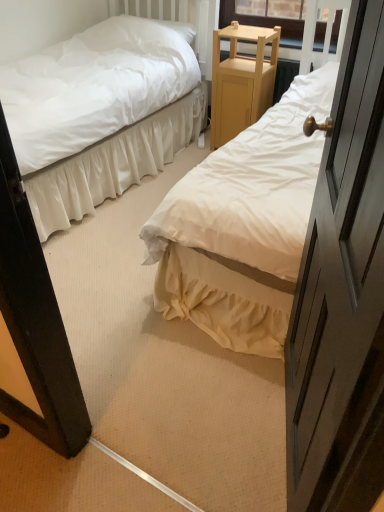
Measure the distance between point (222, 174) and camera.

5.95 feet.

Image resolution: width=384 pixels, height=512 pixels. I want to click on white soft pillow at upper left, so click(x=180, y=29).

What is the approximate width of white satin bed at center, which is the 1th bed in left-to-right order?

1.11 meters.

You are a GUI agent. You are given a task and a screenshot of the screen. Output one action in this format:
    pyautogui.click(x=<x>, y=<y>)
    Task: Click on the white cotton bed at center, arranged as the 1th bed when viewed from the right
    Image resolution: width=384 pixels, height=512 pixels.
    Given the screenshot: What is the action you would take?
    pyautogui.click(x=243, y=225)

Can you confirm if white soft pillow at upper left is thinner than white satin bed at center, which is the 1th bed in left-to-right order?

Indeed, white soft pillow at upper left has a lesser width compared to white satin bed at center, which is the 1th bed in left-to-right order.

From a real-world perspective, which is physically above, white soft pillow at upper left or white satin bed at center, the 2th bed when ordered from right to left?

In real-world perspective, white soft pillow at upper left is above.

Considering the positions of point (180, 22) and point (77, 169), is point (180, 22) closer or farther from the camera than point (77, 169)?

Clearly, point (180, 22) is more distant from the camera than point (77, 169).

Which object is further away from the camera taking this photo, light wood/finely crafted nightstand at center or white soft pillow at upper left?

white soft pillow at upper left.

How many degrees apart are the facing directions of light wood/finely crafted nightstand at center and white soft pillow at upper left?

The angle between the facing direction of light wood/finely crafted nightstand at center and the facing direction of white soft pillow at upper left is 0.635 degrees.

From a real-world perspective, is light wood/finely crafted nightstand at center physically below white soft pillow at upper left?

Correct, in the physical world, light wood/finely crafted nightstand at center is lower than white soft pillow at upper left.

Does light wood/finely crafted nightstand at center have a greater width compared to white soft pillow at upper left?

Correct, the width of light wood/finely crafted nightstand at center exceeds that of white soft pillow at upper left.

Considering the relative sizes of white cotton bed at center, arranged as the 1th bed when viewed from the right, and white soft pillow at upper left in the image provided, is white cotton bed at center, arranged as the 1th bed when viewed from the right, shorter than white soft pillow at upper left?

No.

Is white cotton bed at center, arranged as the 1th bed when viewed from the right, oriented away from white soft pillow at upper left?

No.

From the image's perspective, who appears lower, white cotton bed at center, the 2th bed positioned from the left, or light wood/finely crafted nightstand at center?

From the image's view, white cotton bed at center, the 2th bed positioned from the left, is below.

Is white cotton bed at center, arranged as the 1th bed when viewed from the right, behind light wood/finely crafted nightstand at center?

No, white cotton bed at center, arranged as the 1th bed when viewed from the right, is in front of light wood/finely crafted nightstand at center.

Does white cotton bed at center, the 2th bed positioned from the left, have a greater width compared to light wood/finely crafted nightstand at center?

Yes, white cotton bed at center, the 2th bed positioned from the left, is wider than light wood/finely crafted nightstand at center.

Based on the photo, is white cotton bed at center, arranged as the 1th bed when viewed from the right, looking in the opposite direction of light wood/finely crafted nightstand at center?

No, white cotton bed at center, arranged as the 1th bed when viewed from the right, is not facing the opposite direction of light wood/finely crafted nightstand at center.

Based on the photo, considering the sizes of objects white satin bed at center, the 2th bed when ordered from right to left, and white cotton bed at center, the 2th bed positioned from the left, in the image provided, who is wider, white satin bed at center, the 2th bed when ordered from right to left, or white cotton bed at center, the 2th bed positioned from the left,?

white cotton bed at center, the 2th bed positioned from the left.

Where is `bed beneath the white cotton bed at center, the 2th bed positioned from the left (from a real-world perspective)`? bed beneath the white cotton bed at center, the 2th bed positioned from the left (from a real-world perspective) is located at coordinates (91, 132).

Considering the sizes of objects white satin bed at center, the 2th bed when ordered from right to left, and white cotton bed at center, arranged as the 1th bed when viewed from the right, in the image provided, who is shorter, white satin bed at center, the 2th bed when ordered from right to left, or white cotton bed at center, arranged as the 1th bed when viewed from the right,?

With less height is white satin bed at center, the 2th bed when ordered from right to left.

Is white satin bed at center, which is the 1th bed in left-to-right order, facing away from white cotton bed at center, arranged as the 1th bed when viewed from the right?

Correct, white satin bed at center, which is the 1th bed in left-to-right order, is looking away from white cotton bed at center, arranged as the 1th bed when viewed from the right.

How many degrees apart are the facing directions of light wood/finely crafted nightstand at center and white satin bed at center, the 2th bed when ordered from right to left?

91.4 degrees separate the facing orientations of light wood/finely crafted nightstand at center and white satin bed at center, the 2th bed when ordered from right to left.

Does light wood/finely crafted nightstand at center have a smaller size compared to white satin bed at center, which is the 1th bed in left-to-right order?

Yes.

Is light wood/finely crafted nightstand at center behind white satin bed at center, the 2th bed when ordered from right to left?

Yes, the depth of light wood/finely crafted nightstand at center is greater than that of white satin bed at center, the 2th bed when ordered from right to left.

From the image's perspective, count 1st beds downward from the light wood/finely crafted nightstand at center and point to it. Please provide its 2D coordinates.

[(91, 132)]

Considering the positions of objects white cotton bed at center, the 2th bed positioned from the left, and white satin bed at center, the 2th bed when ordered from right to left, in the image provided, who is behind, white cotton bed at center, the 2th bed positioned from the left, or white satin bed at center, the 2th bed when ordered from right to left,?

white satin bed at center, the 2th bed when ordered from right to left.

Can you confirm if white cotton bed at center, arranged as the 1th bed when viewed from the right, is shorter than white satin bed at center, the 2th bed when ordered from right to left?

Incorrect, the height of white cotton bed at center, arranged as the 1th bed when viewed from the right, does not fall short of that of white satin bed at center, the 2th bed when ordered from right to left.

Consider the image. From a real-world perspective, between white cotton bed at center, arranged as the 1th bed when viewed from the right, and white satin bed at center, which is the 1th bed in left-to-right order, who is vertically higher?

From a 3D spatial view, white cotton bed at center, arranged as the 1th bed when viewed from the right, is above.

At what (x,y) coordinates should I click in order to perform the action: click on bed that appears on the left of white soft pillow at upper left. Please return your answer as a coordinate pair (x, y). This screenshot has width=384, height=512. Looking at the image, I should click on (91, 132).

In order to click on pillow that appears above the light wood/finely crafted nightstand at center (from a real-world perspective) in this screenshot , I will do `click(180, 29)`.

From the image, which object appears to be farther from white soft pillow at upper left, light wood/finely crafted nightstand at center or white cotton bed at center, the 2th bed positioned from the left?

The object further to white soft pillow at upper left is white cotton bed at center, the 2th bed positioned from the left.

Which object lies nearer to the anchor point white satin bed at center, which is the 1th bed in left-to-right order, white cotton bed at center, arranged as the 1th bed when viewed from the right, or light wood/finely crafted nightstand at center?

light wood/finely crafted nightstand at center lies closer to white satin bed at center, which is the 1th bed in left-to-right order, than the other object.

Looking at the image, which one is located closer to white cotton bed at center, arranged as the 1th bed when viewed from the right, white satin bed at center, which is the 1th bed in left-to-right order, or light wood/finely crafted nightstand at center?

Among the two, light wood/finely crafted nightstand at center is located nearer to white cotton bed at center, arranged as the 1th bed when viewed from the right.

Looking at the image, which one is located closer to white soft pillow at upper left, white satin bed at center, the 2th bed when ordered from right to left, or light wood/finely crafted nightstand at center?

light wood/finely crafted nightstand at center is closer to white soft pillow at upper left.

Estimate the real-world distances between objects in this image. Which object is further from light wood/finely crafted nightstand at center, white satin bed at center, the 2th bed when ordered from right to left, or white soft pillow at upper left?

white satin bed at center, the 2th bed when ordered from right to left.

From the picture: Which object lies nearer to the anchor point white satin bed at center, the 2th bed when ordered from right to left, white soft pillow at upper left or light wood/finely crafted nightstand at center?

The object closer to white satin bed at center, the 2th bed when ordered from right to left, is light wood/finely crafted nightstand at center.

Based on their spatial positions, is white cotton bed at center, the 2th bed positioned from the left, or white satin bed at center, which is the 1th bed in left-to-right order, further from white soft pillow at upper left?

Among the two, white cotton bed at center, the 2th bed positioned from the left, is located further to white soft pillow at upper left.

Estimate the real-world distances between objects in this image. Which object is closer to white soft pillow at upper left, white satin bed at center, the 2th bed when ordered from right to left, or white cotton bed at center, the 2th bed positioned from the left?

Among the two, white satin bed at center, the 2th bed when ordered from right to left, is located nearer to white soft pillow at upper left.

Locate an element on the screen. This screenshot has width=384, height=512. bed between white cotton bed at center, arranged as the 1th bed when viewed from the right, and white soft pillow at upper left, along the z-axis is located at coordinates (91, 132).

I want to click on bed between white cotton bed at center, arranged as the 1th bed when viewed from the right, and light wood/finely crafted nightstand at center, along the z-axis, so click(91, 132).

Locate an element on the screen. This screenshot has height=512, width=384. furniture between white satin bed at center, the 2th bed when ordered from right to left, and white soft pillow at upper left, along the z-axis is located at coordinates (241, 81).

Locate an element on the screen. This screenshot has width=384, height=512. furniture between white cotton bed at center, arranged as the 1th bed when viewed from the right, and white soft pillow at upper left in the front-back direction is located at coordinates (241, 81).